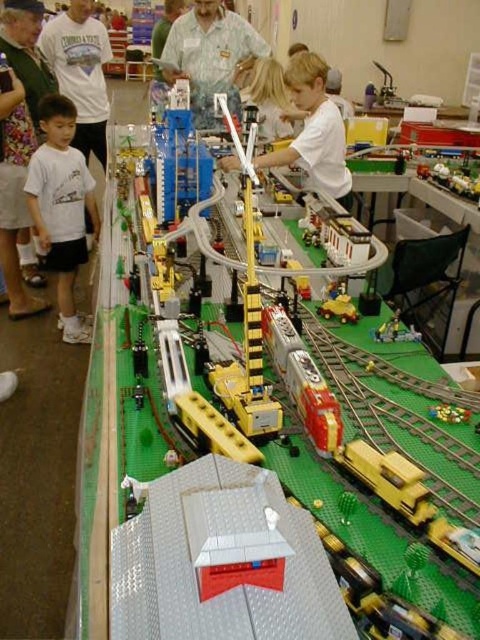
You are a parent at the exhibition and want to ensure the white matte boy at center is visible to a child standing on the yellow plastic train at center. Is the boy taller than the train?

The white matte boy at center is much taller than the yellow plastic train at center, so yes, the boy is taller and will be visible to the child on the train.

You are organizing a display at a model train exhibition and need to ensure that all items fit within a 1.2 meter wide display case. You have a white cotton shirt at left and a metallic yellow train at center. Based on their sizes, will both items fit side by side within the case?

The white cotton shirt at left is wider than the metallic yellow train at center. However, without knowing the exact widths of both items, it is impossible to determine if they will fit side by side within the 1.2 meter display case. Additional measurements are needed.